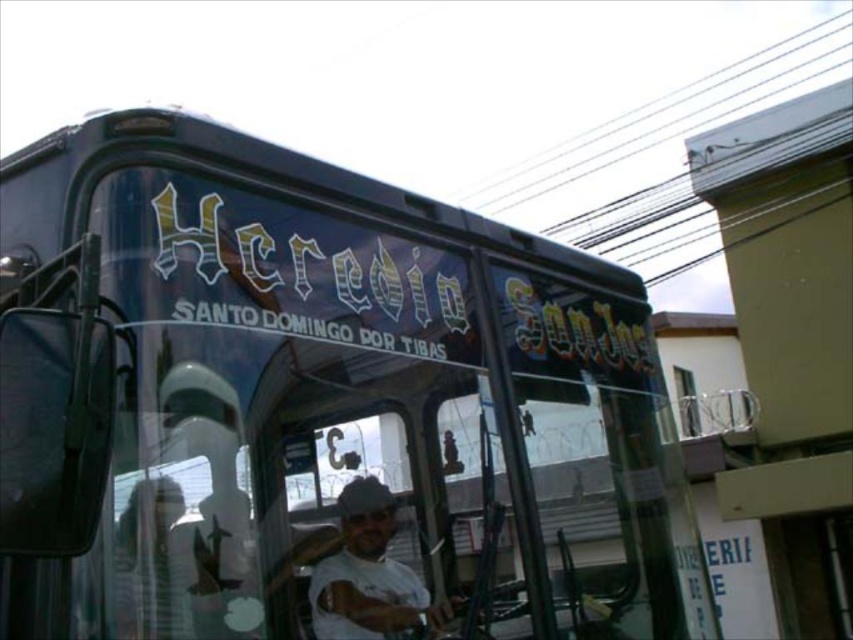
Does shiny dark green bus at center have a smaller size compared to white matte shirt at center?

No.

Who is higher up, shiny dark green bus at center or white matte shirt at center?

shiny dark green bus at center is above.

The image size is (853, 640). I want to click on shiny dark green bus at center, so click(x=318, y=408).